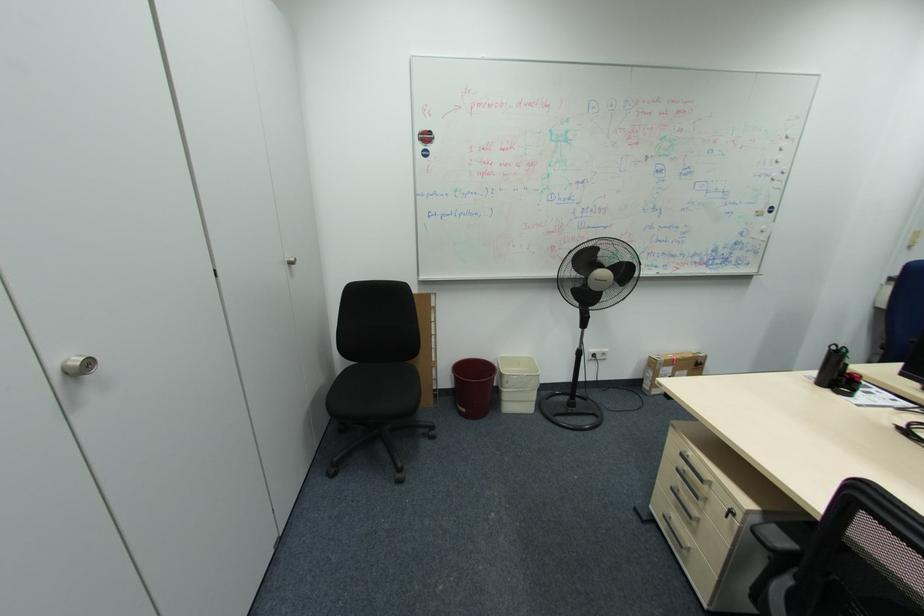
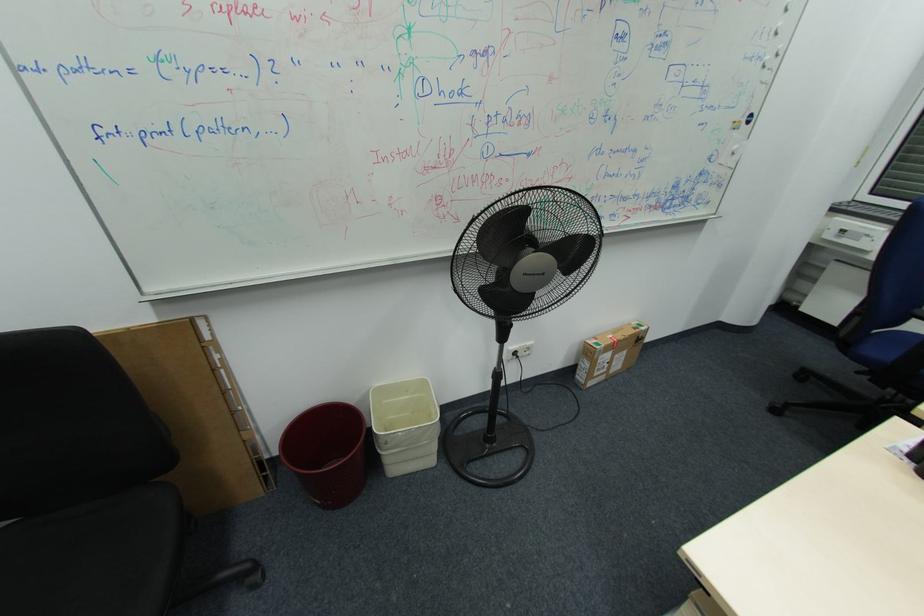
Question: In a continuous first-person perspective shot, in which direction is the camera moving?

Choices:
 (A) Left
 (B) Right
 (C) Forward
 (D) Backward

Answer: (C)